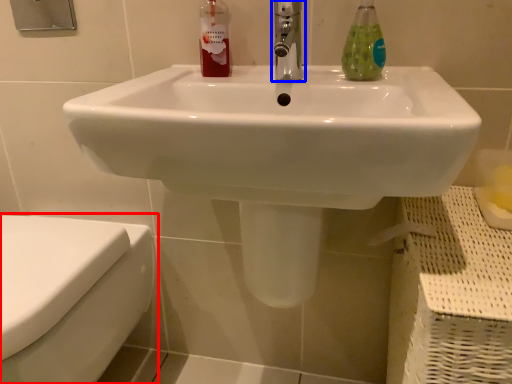
Question: Among these objects, which one is farthest to the camera, toilet (highlighted by a red box) or tap (highlighted by a blue box)?

Choices:
 (A) toilet
 (B) tap

Answer: (B)